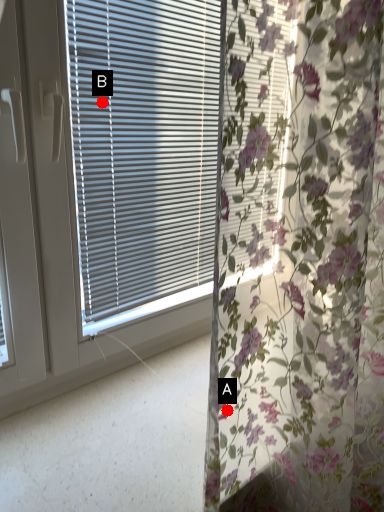
Question: Two points are circled on the image, labeled by A and B beside each circle. Among these points, which one is nearest to the camera?

Choices:
 (A) A is closer
 (B) B is closer

Answer: (A)